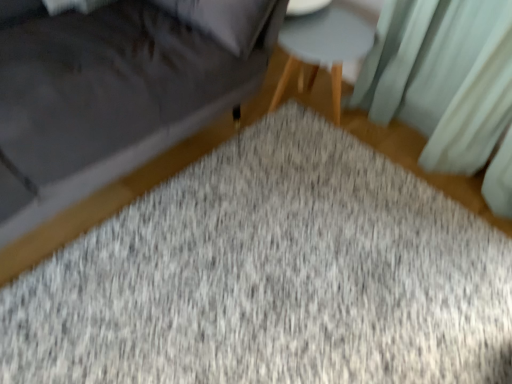
Question: Would you say velvet gray sofa at lower left is part of light gray wood stool at center's contents?

Choices:
 (A) no
 (B) yes

Answer: (A)

Question: Can you confirm if light gray wood stool at center is shorter than velvet gray sofa at lower left?

Choices:
 (A) no
 (B) yes

Answer: (B)

Question: Is light gray wood stool at center at the left side of velvet gray sofa at lower left?

Choices:
 (A) yes
 (B) no

Answer: (B)

Question: Does light gray wood stool at center come in front of velvet gray sofa at lower left?

Choices:
 (A) yes
 (B) no

Answer: (B)

Question: Is light gray wood stool at center further to the viewer compared to velvet gray sofa at lower left?

Choices:
 (A) no
 (B) yes

Answer: (B)

Question: Considering the positions of point (250, 77) and point (248, 230), is point (250, 77) closer or farther from the camera than point (248, 230)?

Choices:
 (A) farther
 (B) closer

Answer: (A)

Question: Considering the positions of velvet gray sofa at lower left and gray textured mat at center in the image, is velvet gray sofa at lower left wider or thinner than gray textured mat at center?

Choices:
 (A) wide
 (B) thin

Answer: (B)

Question: From a real-world perspective, is velvet gray sofa at lower left positioned above or below gray textured mat at center?

Choices:
 (A) above
 (B) below

Answer: (A)

Question: Is velvet gray sofa at lower left situated inside gray textured mat at center or outside?

Choices:
 (A) outside
 (B) inside

Answer: (A)

Question: Is point (330, 51) positioned closer to the camera than point (151, 297)?

Choices:
 (A) closer
 (B) farther

Answer: (B)

Question: From the image's perspective, relative to gray textured mat at center, is light gray wood stool at center above or below?

Choices:
 (A) above
 (B) below

Answer: (A)

Question: Considering the positions of light gray wood stool at center and gray textured mat at center in the image, is light gray wood stool at center taller or shorter than gray textured mat at center?

Choices:
 (A) short
 (B) tall

Answer: (B)

Question: Relative to gray textured mat at center, is light gray wood stool at center in front or behind?

Choices:
 (A) behind
 (B) front

Answer: (A)

Question: Considering their positions, is light teal fabric curtain at upper right located in front of or behind gray textured mat at center?

Choices:
 (A) front
 (B) behind

Answer: (B)

Question: From their relative heights in the image, would you say light teal fabric curtain at upper right is taller or shorter than gray textured mat at center?

Choices:
 (A) short
 (B) tall

Answer: (B)